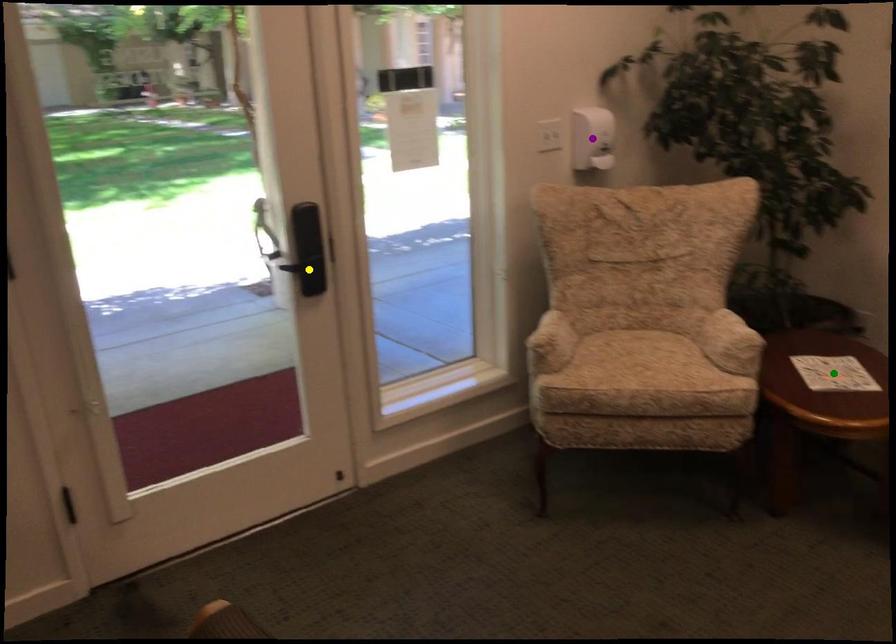
Order these from nearest to farthest:
1. green point
2. yellow point
3. purple point

green point → yellow point → purple point